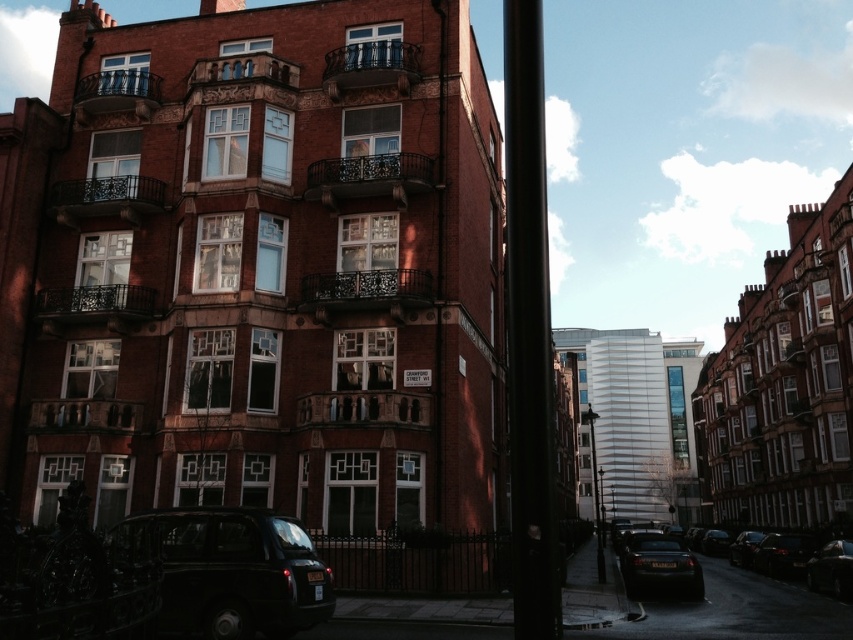
You are standing at the entrance of the large ornate brick building and want to locate the black matte pole at center. According to the coordinates provided, where exactly should you look to find it?

The black matte pole at center is located at coordinates point 0.517 on the x axis and 0.621 on the y axis.